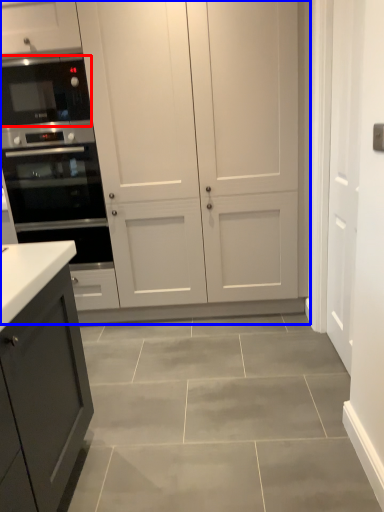
Question: Which of the following is the farthest to the observer, microwave oven (highlighted by a red box) or cupboard (highlighted by a blue box)?

Choices:
 (A) microwave oven
 (B) cupboard

Answer: (A)